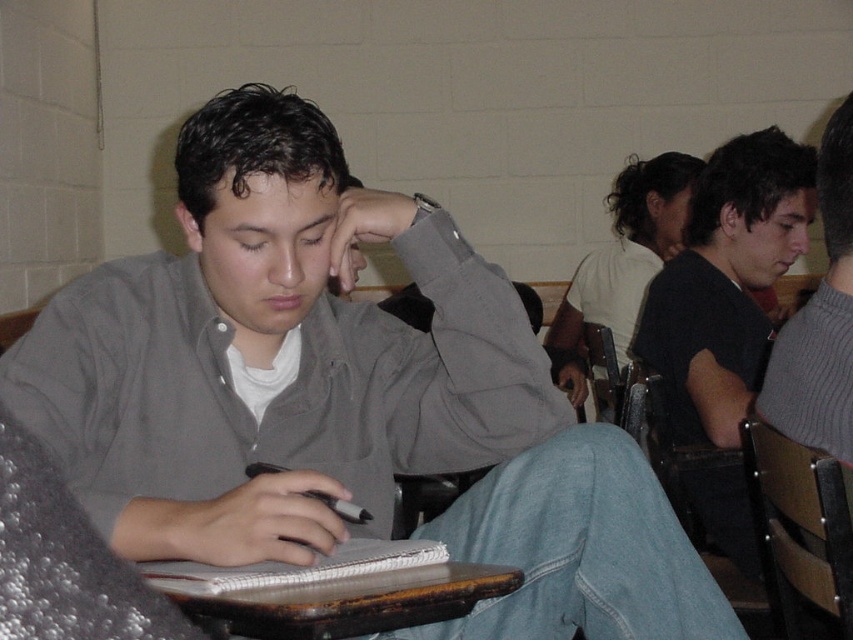
Question: Does wooden chair at right come in front of dark brown hair at upper center?

Choices:
 (A) yes
 (B) no

Answer: (A)

Question: Is brown wooden table at lower center further to the viewer compared to matte gray hair at center?

Choices:
 (A) yes
 (B) no

Answer: (B)

Question: Which point is farther from the camera taking this photo?

Choices:
 (A) (489, 579)
 (B) (799, 234)

Answer: (B)

Question: Is brown wooden table at lower center wider than wooden chair at right?

Choices:
 (A) no
 (B) yes

Answer: (B)

Question: Which point is closer to the camera?

Choices:
 (A) white paper notebook at center
 (B) brown wooden table at lower center
 (C) matte gray shirt at center

Answer: (B)

Question: Which object is positioned closest to the wooden chair at right?

Choices:
 (A) white paper notebook at center
 (B) matte gray hair at center
 (C) white matte shirt at upper right

Answer: (A)